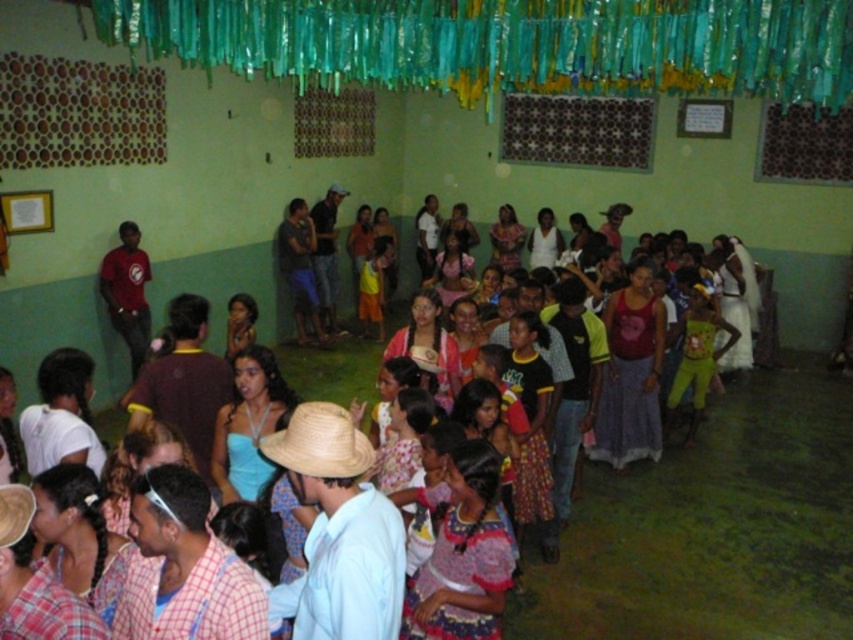
Question: Is straw hat at center behind straw hat at lower left?

Choices:
 (A) yes
 (B) no

Answer: (A)

Question: Which of the following is the farthest from the observer?

Choices:
 (A) (6, 540)
 (B) (662, 488)
 (C) (181, 4)

Answer: (B)

Question: Is printed cotton dress at center below straw hat at center?

Choices:
 (A) yes
 (B) no

Answer: (A)

Question: Which of the following is the farthest from the observer?

Choices:
 (A) straw hat at lower left
 (B) straw hat at center
 (C) diverse clothing at center
 (D) teal fabric curtain at upper center

Answer: (C)

Question: Estimate the real-world distances between objects in this image. Which object is farther from the teal fabric curtain at upper center?

Choices:
 (A) diverse clothing at center
 (B) straw hat at center
 (C) straw hat at lower left
 (D) printed cotton dress at center

Answer: (C)

Question: Does straw hat at center lie behind straw hat at lower left?

Choices:
 (A) yes
 (B) no

Answer: (A)